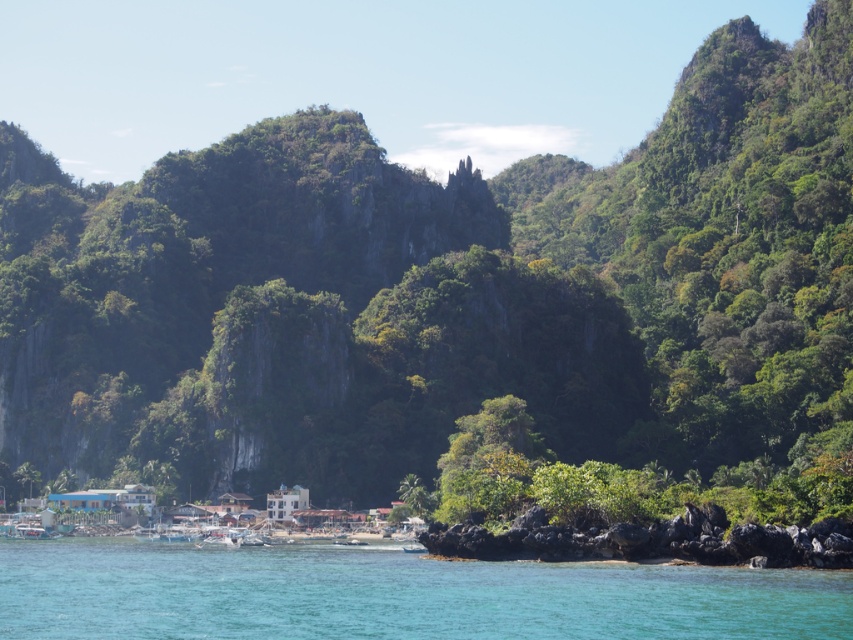
Between point (604, 566) and point (807, 554), which one is positioned behind?

The point (604, 566) is behind.

What do you see at coordinates (393, 595) in the screenshot? Image resolution: width=853 pixels, height=640 pixels. I see `clear blue water at lower center` at bounding box center [393, 595].

At what (x,y) coordinates should I click in order to perform the action: click on clear blue water at lower center. Please return your answer as a coordinate pair (x, y). This screenshot has height=640, width=853. Looking at the image, I should click on (393, 595).